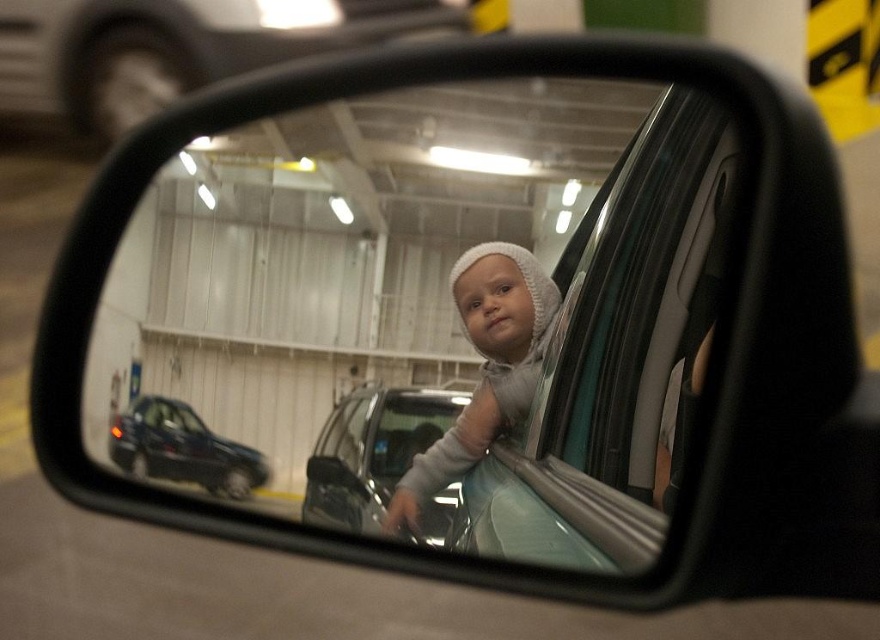
Question: Estimate the real-world distances between objects in this image. Which object is farther from the white knit hat at center?

Choices:
 (A) metallic car at upper center
 (B) metallic gray car at center
 (C) shiny black car at lower left

Answer: (A)

Question: Does metallic car at upper center appear on the right side of white knit hat at center?

Choices:
 (A) yes
 (B) no

Answer: (B)

Question: Does metallic car at upper center lie behind shiny black car at lower left?

Choices:
 (A) no
 (B) yes

Answer: (B)

Question: Can you confirm if white knit hat at center is thinner than metallic gray car at center?

Choices:
 (A) yes
 (B) no

Answer: (B)

Question: Which object is closer to the camera taking this photo?

Choices:
 (A) shiny black car at lower left
 (B) white knit hat at center
 (C) metallic gray car at center
 (D) metallic car at upper center

Answer: (C)

Question: Which of these objects is positioned farthest from the shiny black car at lower left?

Choices:
 (A) metallic car at upper center
 (B) metallic gray car at center

Answer: (A)